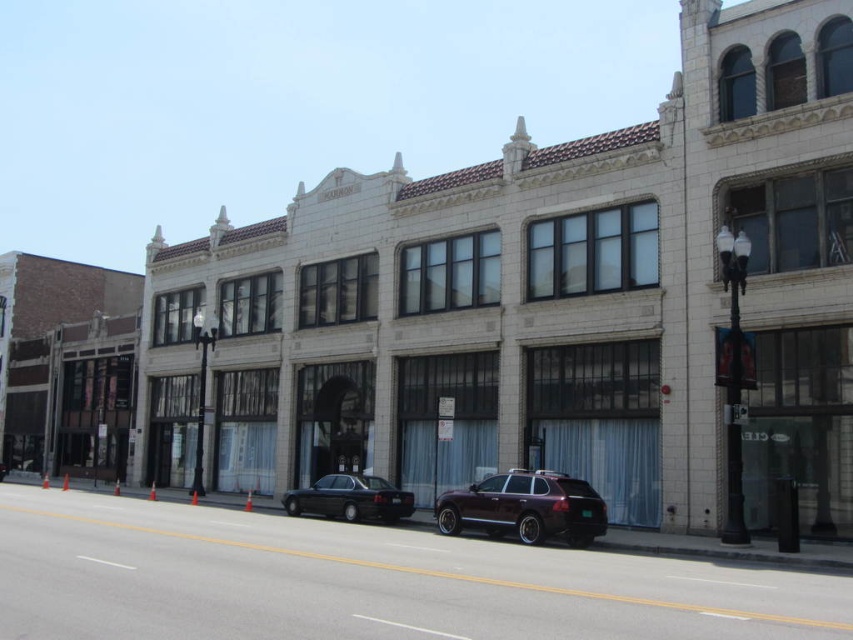
Is satin burgundy suv at center smaller than shiny black sedan at center?

Yes, satin burgundy suv at center is smaller than shiny black sedan at center.

Locate an element on the screen. Image resolution: width=853 pixels, height=640 pixels. satin burgundy suv at center is located at coordinates (525, 508).